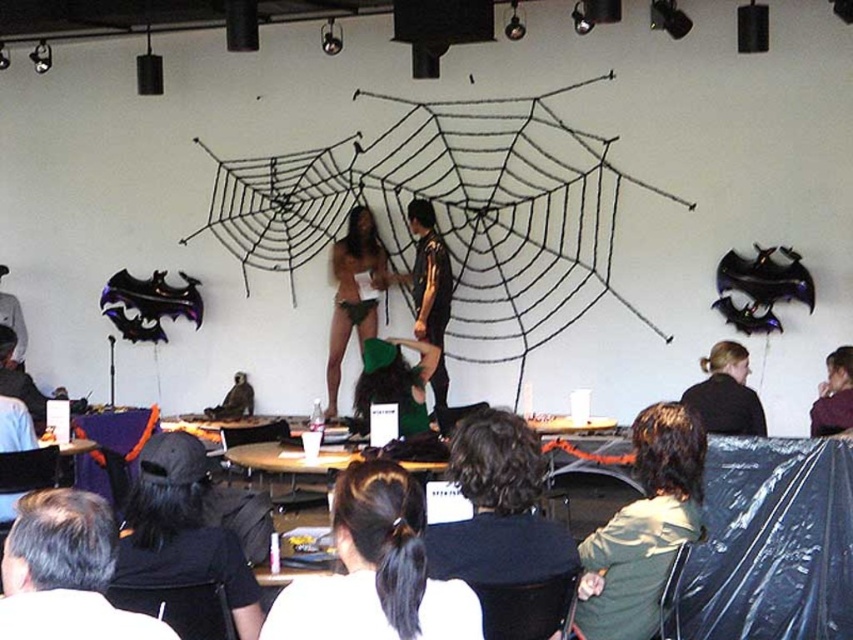
You are a photographer at the Halloween event. You want to take a photo of both the black hair at center and the matte black shirt at lower right. Can you position yourself so that both are fully visible without one blocking the other?

The black hair at center is in front of the matte black shirt at lower right, so if you position yourself behind the matte black shirt at lower right, both will be visible without obstruction.

Based on the photo, you are standing at the origin point in the room. There are two points marked in the scene. Which point is closer to you? The points are labeled as point 1 at coordinates point (347, 301) and point 2 at coordinates point (448, 289).

Point 2 at coordinates point (448, 289) is closer to you because it is in front of point 1 at coordinates point (347, 301).